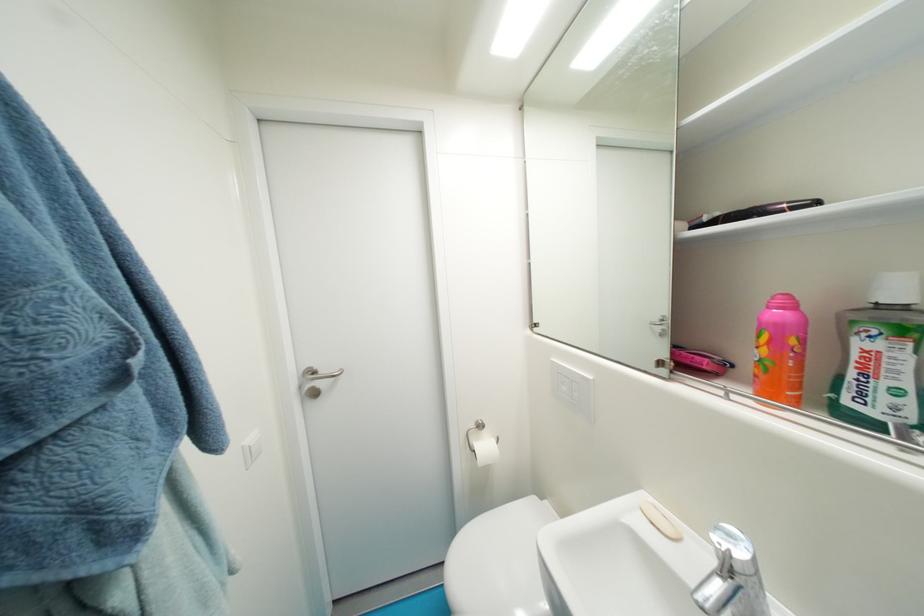
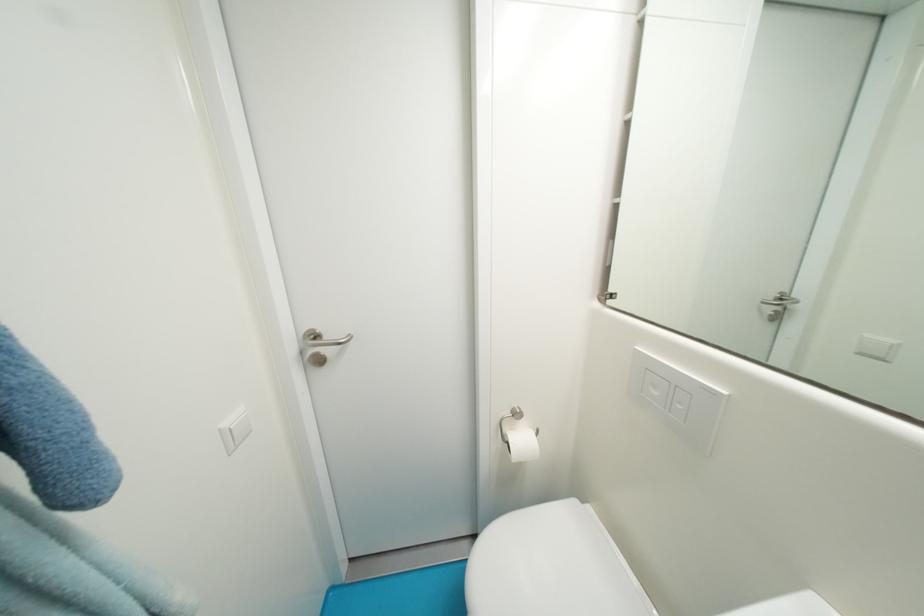
Find the pixel in the second image that matches point (570, 390) in the first image.

(662, 395)